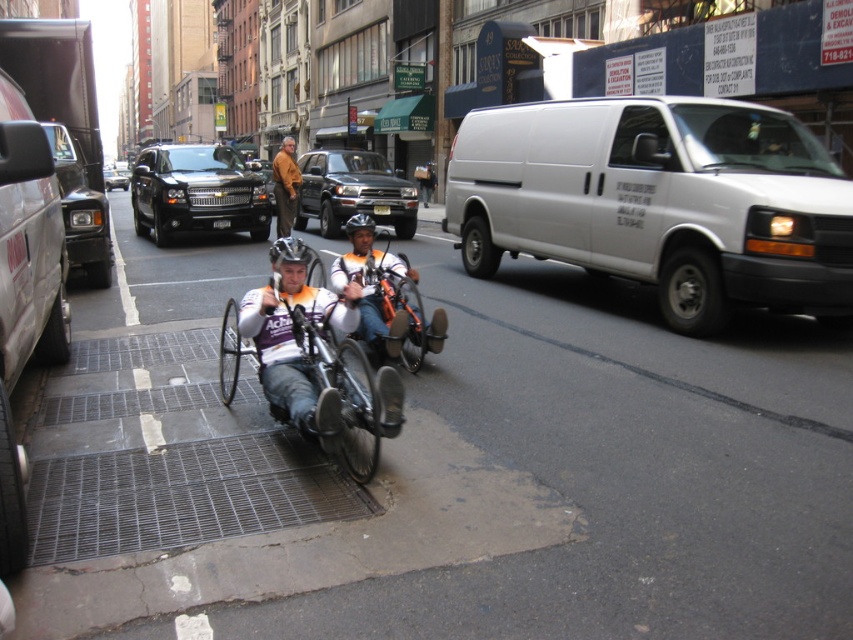
You are a delivery person who needs to load an orange metallic wheelchair at center into the trunk of a matte black suv at center. Based on the scene, will the wheelchair fit vertically inside the trunk?

The orange metallic wheelchair at center has a lesser height compared to matte black suv at center, so it should fit vertically inside the trunk as long as the trunk height is sufficient to accommodate the wheelchair.